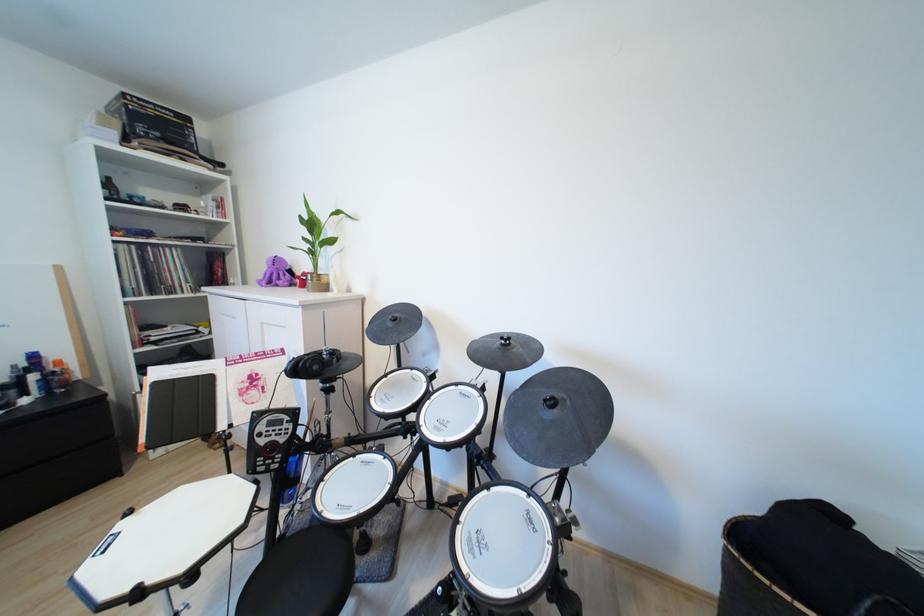
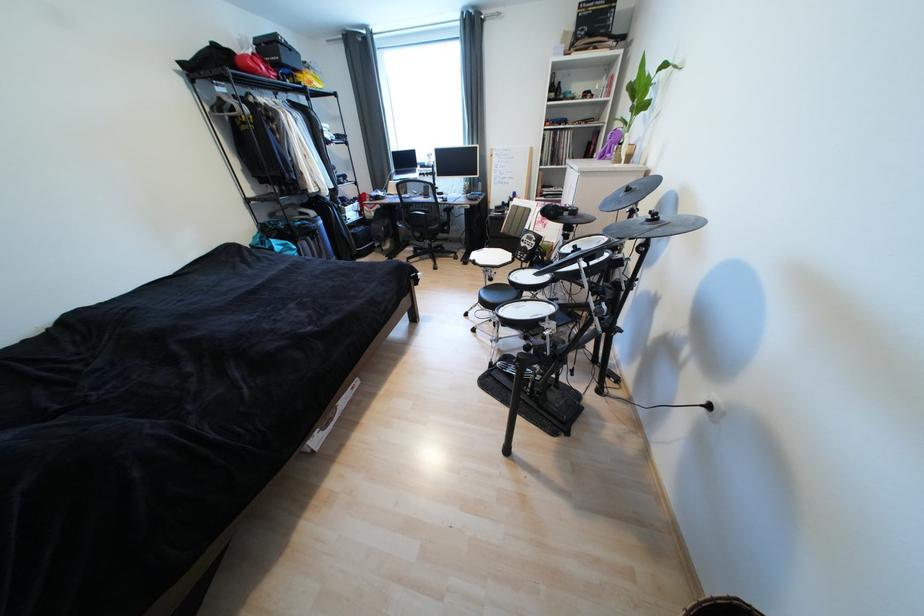
The point at [507,346] is marked in the first image. Where is the corresponding point in the second image?

(655, 222)